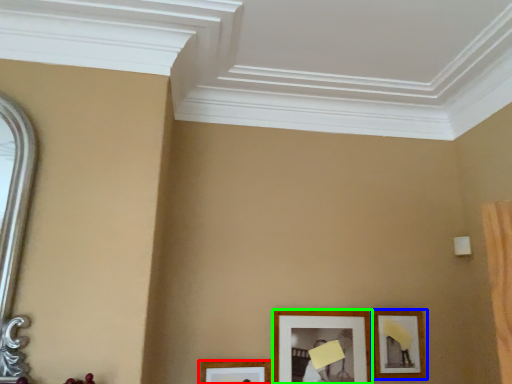
Question: Which is farther away from picture frame (highlighted by a red box)? picture frame (highlighted by a blue box) or picture frame (highlighted by a green box)?

Choices:
 (A) picture frame
 (B) picture frame

Answer: (A)